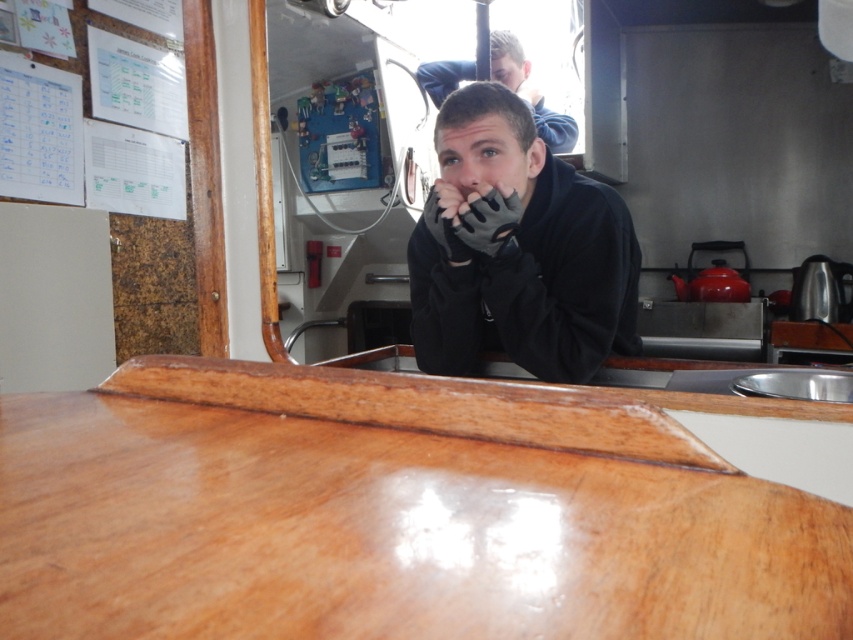
Question: Can you confirm if glossy wood counter at center is positioned to the right of black matte gloves at center?

Choices:
 (A) no
 (B) yes

Answer: (A)

Question: Among these objects, which one is farthest from the camera?

Choices:
 (A) glossy wood counter at center
 (B) black matte gloves at center
 (C) matte black jacket at upper center
 (D) matte black nose at center

Answer: (C)

Question: Which of these objects is positioned closest to the black matte gloves at center?

Choices:
 (A) matte black jacket at upper center
 (B) matte black nose at center
 (C) glossy wood counter at center

Answer: (B)

Question: Which of the following is the closest to the observer?

Choices:
 (A) black matte gloves at center
 (B) matte black nose at center
 (C) glossy wood counter at center
 (D) matte black jacket at upper center

Answer: (C)

Question: Is glossy wood counter at center behind matte black nose at center?

Choices:
 (A) no
 (B) yes

Answer: (A)

Question: Is black matte gloves at center wider than matte black jacket at upper center?

Choices:
 (A) yes
 (B) no

Answer: (B)